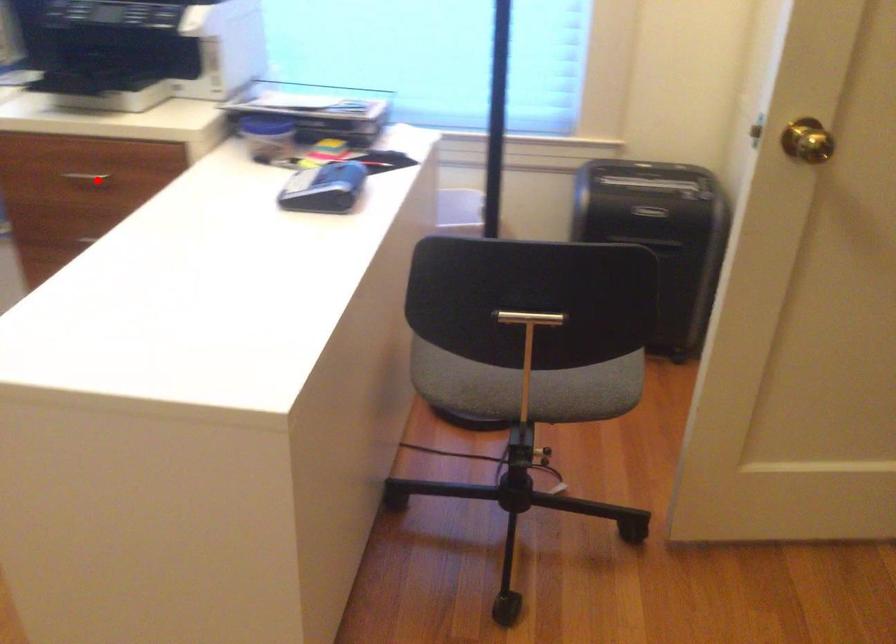
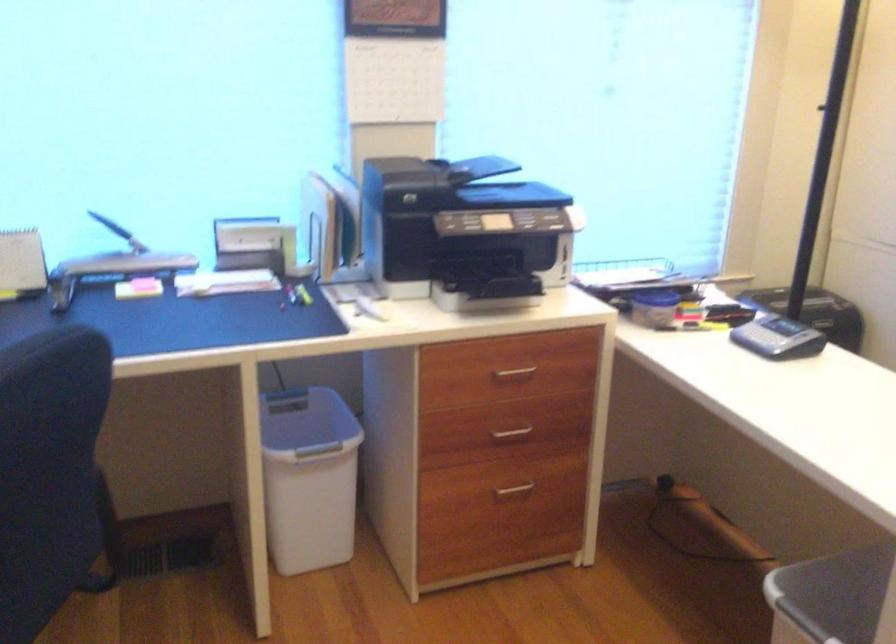
The point at the highlighted location is marked in the first image. Where is the corresponding point in the second image?

(513, 374)